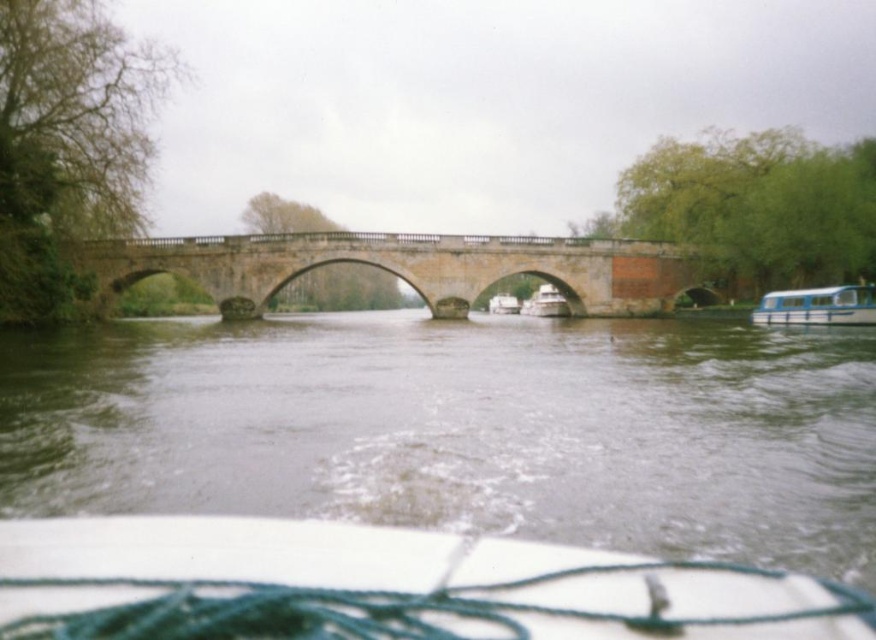
You are standing at the riverside and want to take a photo of the white matte boat at center. If your camera can focus up to 3 meters, will you be able to capture a clear image of the boat?

The white matte boat at center is 3.45 meters away from the camera, which exceeds the camera focus limit of 3 meters. Therefore, the boat will not be in clear focus.

You are a photographer planning to take a picture of the stone bridge at center and the white glossy boat at right from a position on the riverbank. Considering their heights, which object will appear taller in the photo?

The stone bridge at center will appear taller in the photo because it has a greater height compared to the white glossy boat at right.